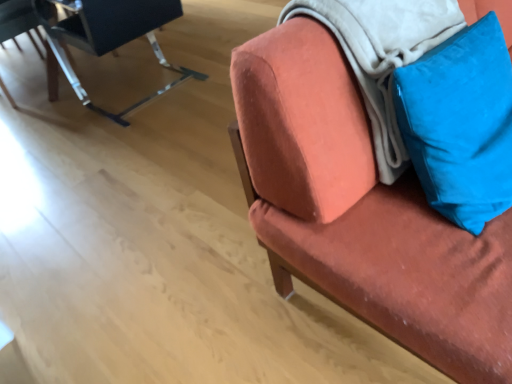
Where is `unoccupied area in front of metallic black chair at upper left, which appears as the second chair when viewed from the right`? This screenshot has height=384, width=512. unoccupied area in front of metallic black chair at upper left, which appears as the second chair when viewed from the right is located at coordinates (134, 147).